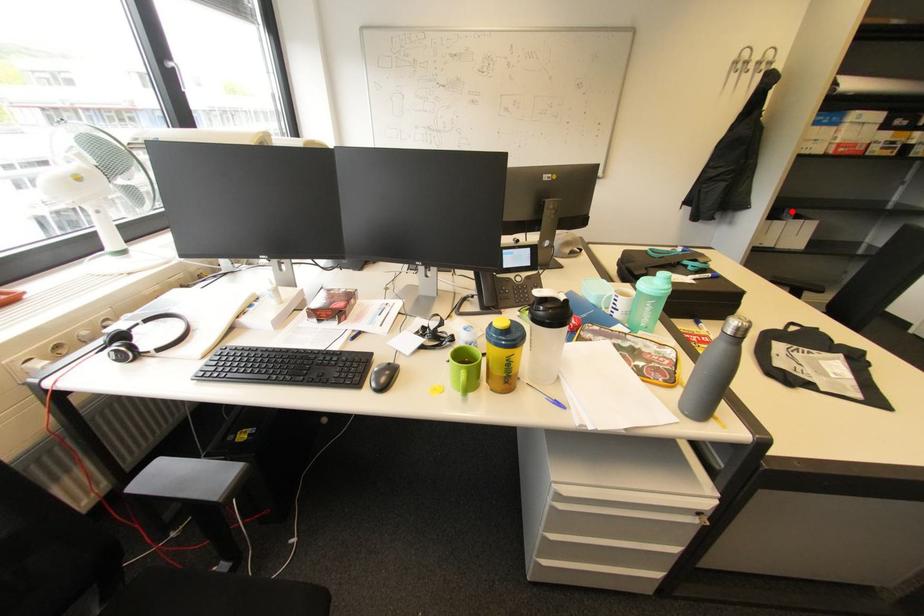
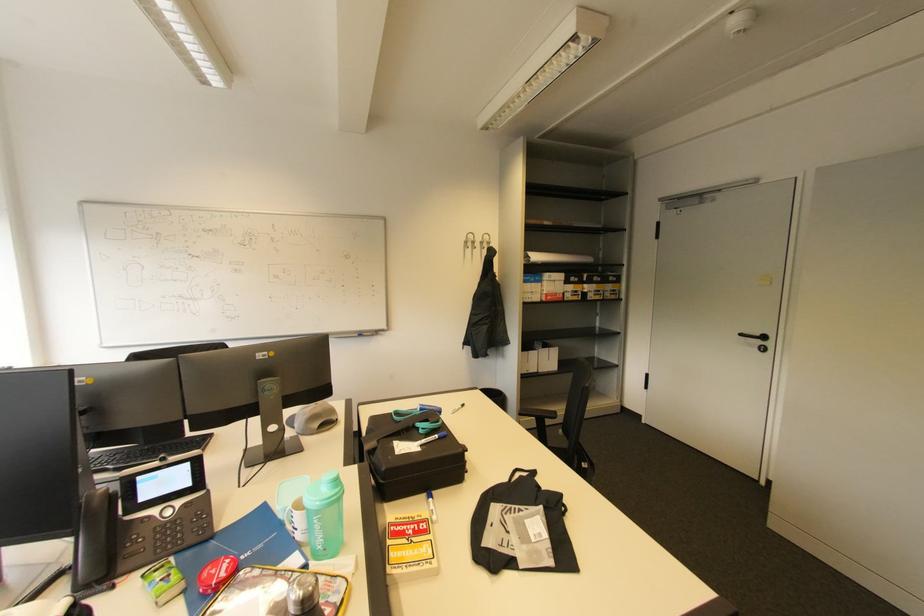
The point at the highlighted location is marked in the first image. Where is the corresponding point in the second image?

(541, 342)